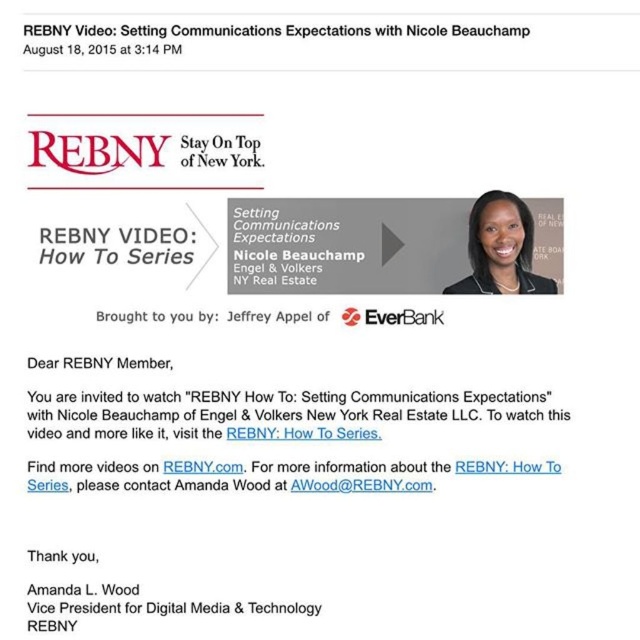
You are standing 2 meters away from the REBNY promotional email. There is a point at coordinates [168,420]. Can you determine if this point is closer to you or farther away than your current distance?

The point at coordinates [168,420] is 1.63 meters away from the viewer. Since you are standing 2 meters away from the REBNY promotional email, the point is closer to you than your current distance of 2 meters.